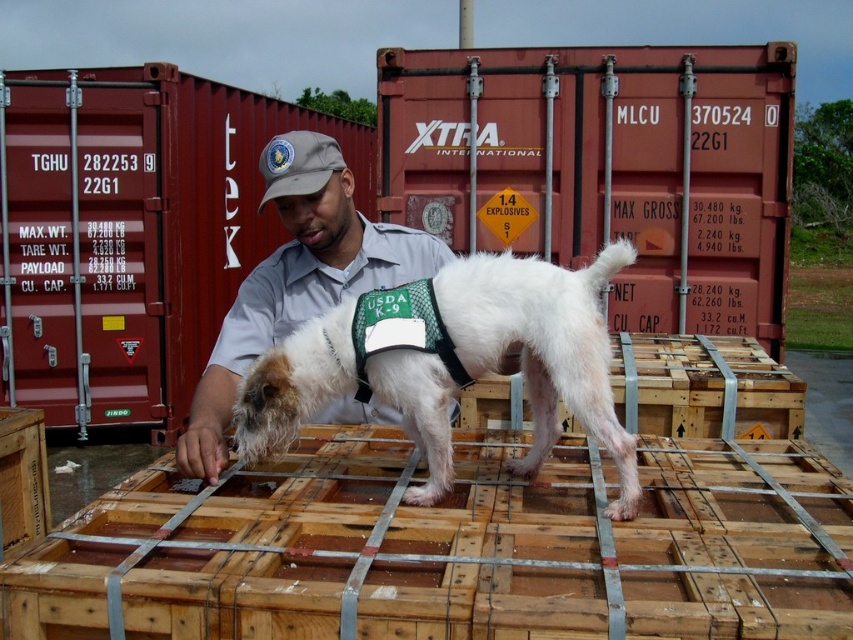
At what (x,y) coordinates should I click in order to perform the action: click on red metal shipping container at center. Please return your answer as a coordinate pair (x, y). Image resolution: width=853 pixels, height=640 pixels. Looking at the image, I should click on (606, 168).

Is red metal shipping container at center to the right of gray uniform at center from the viewer's perspective?

Indeed, red metal shipping container at center is positioned on the right side of gray uniform at center.

Locate an element on the screen. The width and height of the screenshot is (853, 640). red metal shipping container at center is located at coordinates (606, 168).

The width and height of the screenshot is (853, 640). Find the location of `red metal shipping container at center`. red metal shipping container at center is located at coordinates (606, 168).

Is maroon metal shipping container at center behind gray uniform at center?

Yes, it is.

Can you confirm if maroon metal shipping container at center is thinner than gray uniform at center?

No, maroon metal shipping container at center is not thinner than gray uniform at center.

Is point (96, 120) farther from camera compared to point (285, 278)?

Yes, point (96, 120) is behind point (285, 278).

You are a GUI agent. You are given a task and a screenshot of the screen. Output one action in this format:
    pyautogui.click(x=<x>, y=<y>)
    Task: Click on the maroon metal shipping container at center
    
    Given the screenshot: What is the action you would take?
    pyautogui.click(x=132, y=234)

Does red metal shipping container at center appear on the left side of maroon metal shipping container at center?

No, red metal shipping container at center is not to the left of maroon metal shipping container at center.

What do you see at coordinates (606, 168) in the screenshot? I see `red metal shipping container at center` at bounding box center [606, 168].

Where is `red metal shipping container at center`? Image resolution: width=853 pixels, height=640 pixels. red metal shipping container at center is located at coordinates (606, 168).